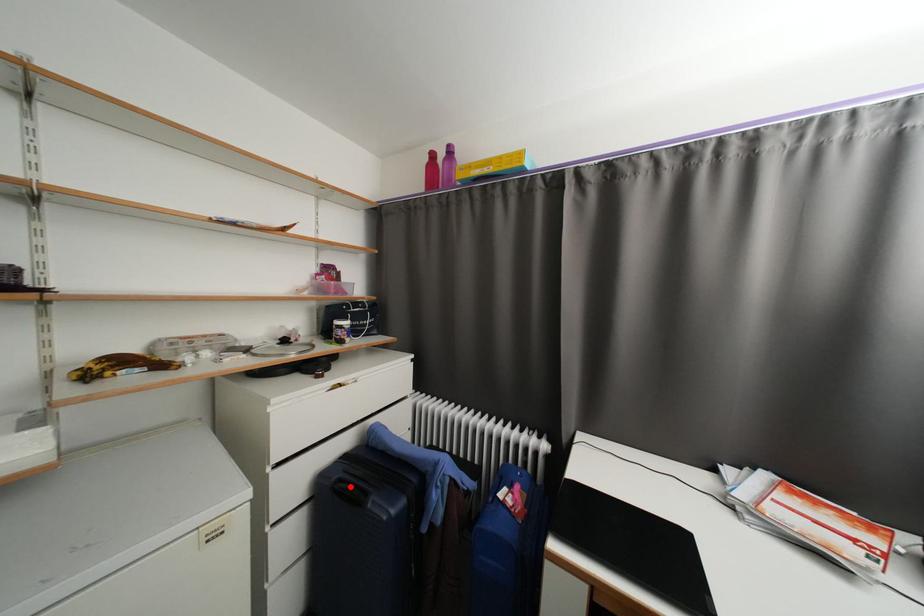
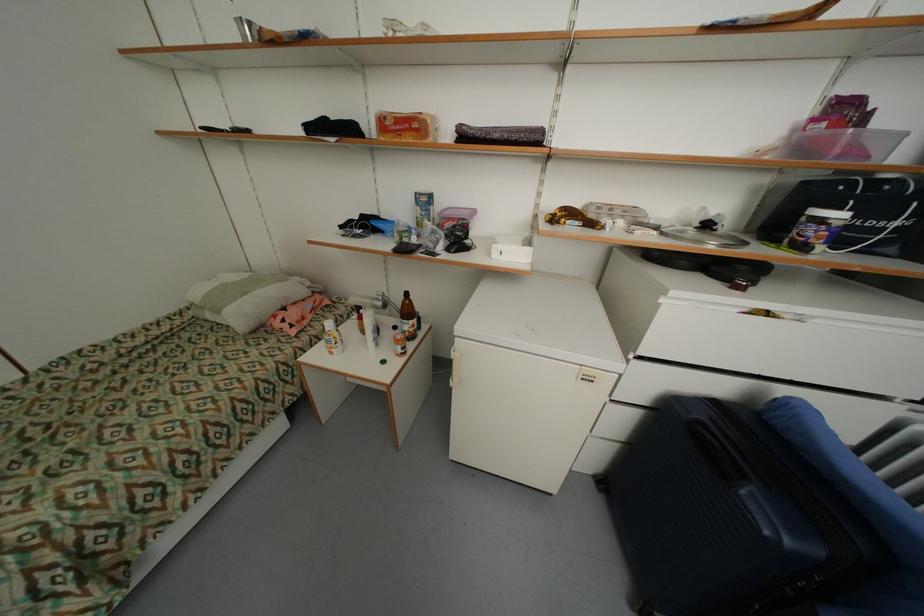
The point at the highlighted location is marked in the first image. Where is the corresponding point in the second image?

(715, 437)